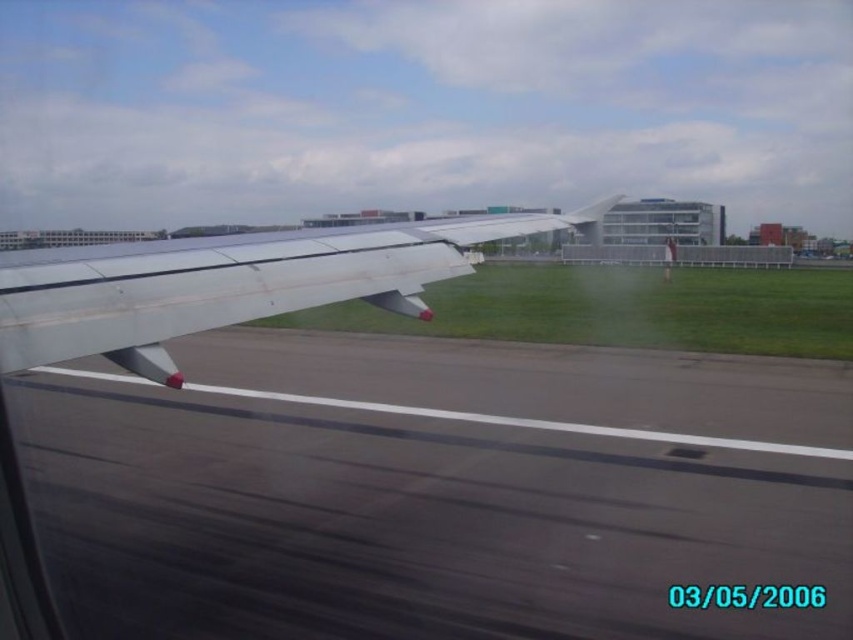
Question: Considering the relative positions of gray asphalt runway at lower left and metallic silver wing at left in the image provided, where is gray asphalt runway at lower left located with respect to metallic silver wing at left?

Choices:
 (A) above
 (B) below

Answer: (B)

Question: From the image, what is the correct spatial relationship of gray asphalt runway at lower left in relation to metallic silver wing at left?

Choices:
 (A) below
 (B) above

Answer: (A)

Question: Which point is farther to the camera?

Choices:
 (A) (440, 221)
 (B) (426, 554)

Answer: (A)

Question: Can you confirm if gray asphalt runway at lower left is wider than metallic silver wing at left?

Choices:
 (A) yes
 (B) no

Answer: (A)

Question: Which point is closer to the camera taking this photo?

Choices:
 (A) (538, 428)
 (B) (138, 346)

Answer: (B)